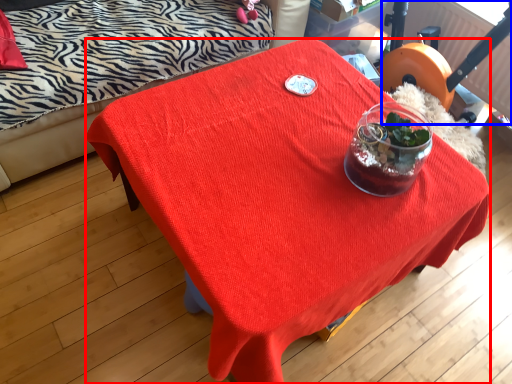
Question: Which object is further to the camera taking this photo, desk (highlighted by a red box) or swivel chair (highlighted by a blue box)?

Choices:
 (A) desk
 (B) swivel chair

Answer: (B)